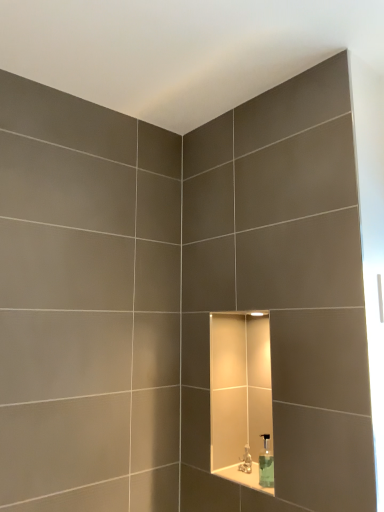
This screenshot has height=512, width=384. What do you see at coordinates (244, 476) in the screenshot?
I see `white glossy ledge at center` at bounding box center [244, 476].

Where is `translucent plastic faucet at center`? This screenshot has width=384, height=512. translucent plastic faucet at center is located at coordinates (246, 461).

Where is `white glossy ledge at center`? The image size is (384, 512). white glossy ledge at center is located at coordinates (244, 476).

Is point (228, 469) positioned behind point (259, 456)?

No, it is in front of (259, 456).

From the picture: From a real-world perspective, between white glossy ledge at center and clear glass soap dispenser at center, who is vertically lower?

In real-world perspective, white glossy ledge at center is lower.

Can you confirm if white glossy ledge at center is wider than clear glass soap dispenser at center?

Yes, white glossy ledge at center is wider than clear glass soap dispenser at center.

Can you tell me how much white glossy ledge at center and clear glass soap dispenser at center differ in facing direction?

They differ by 0.157 degrees in their facing directions.

Which object is closer to the camera, clear glass soap dispenser at center or white glossy ledge at center?

white glossy ledge at center is closer to the camera.

Is clear glass soap dispenser at center bigger than white glossy ledge at center?

Yes, clear glass soap dispenser at center is bigger than white glossy ledge at center.

Find the location of a particular element. ledge lying in front of the clear glass soap dispenser at center is located at coordinates (244, 476).

From a real-world perspective, does clear glass soap dispenser at center stand above white glossy ledge at center?

Yes.

Does point (220, 468) appear closer or farther from the camera than point (246, 462)?

Point (220, 468) is farther from the camera than point (246, 462).

Can you tell me how much white glossy ledge at center and translucent plastic faucet at center differ in facing direction?

The facing directions of white glossy ledge at center and translucent plastic faucet at center are 1.02 degrees apart.

From a real-world perspective, is white glossy ledge at center located beneath translucent plastic faucet at center?

Yes.

How much distance is there between white glossy ledge at center and translucent plastic faucet at center?

A distance of 2.08 inches exists between white glossy ledge at center and translucent plastic faucet at center.

From the picture: From a real-world perspective, which is physically above, translucent plastic faucet at center or clear glass soap dispenser at center?

clear glass soap dispenser at center, from a real-world perspective.

Considering the sizes of objects translucent plastic faucet at center and clear glass soap dispenser at center in the image provided, who is shorter, translucent plastic faucet at center or clear glass soap dispenser at center?

translucent plastic faucet at center.

Would you say translucent plastic faucet at center contains clear glass soap dispenser at center?

No, clear glass soap dispenser at center is not inside translucent plastic faucet at center.

Is translucent plastic faucet at center positioned with its back to clear glass soap dispenser at center?

No.

Which of these two, clear glass soap dispenser at center or translucent plastic faucet at center, is thinner?

With smaller width is translucent plastic faucet at center.

Relative to translucent plastic faucet at center, is clear glass soap dispenser at center in front or behind?

In the image, clear glass soap dispenser at center appears in front of translucent plastic faucet at center.

Identify the location of soap dispenser positioned vertically above the translucent plastic faucet at center (from a real-world perspective). The height and width of the screenshot is (512, 384). (266, 464).

Is clear glass soap dispenser at center positioned with its back to translucent plastic faucet at center?

clear glass soap dispenser at center does not have its back to translucent plastic faucet at center.

From a real-world perspective, is translucent plastic faucet at center positioned above or below white glossy ledge at center?

From a real-world perspective, translucent plastic faucet at center is physically above white glossy ledge at center.

Considering the relative sizes of translucent plastic faucet at center and white glossy ledge at center in the image provided, is translucent plastic faucet at center smaller than white glossy ledge at center?

Yes, translucent plastic faucet at center is smaller than white glossy ledge at center.

From their relative heights in the image, would you say translucent plastic faucet at center is taller or shorter than white glossy ledge at center?

translucent plastic faucet at center is taller than white glossy ledge at center.

Visually, is translucent plastic faucet at center positioned to the left or to the right of white glossy ledge at center?

translucent plastic faucet at center is to the left of white glossy ledge at center.

Identify the location of soap dispenser positioned vertically above the white glossy ledge at center (from a real-world perspective). The height and width of the screenshot is (512, 384). (266, 464).

At what (x,y) coordinates should I click in order to perform the action: click on soap dispenser on the right side of white glossy ledge at center. Please return your answer as a coordinate pair (x, y). Looking at the image, I should click on (266, 464).

Which object lies nearer to the anchor point translucent plastic faucet at center, white glossy ledge at center or clear glass soap dispenser at center?

white glossy ledge at center.

Estimate the real-world distances between objects in this image. Which object is further from translucent plastic faucet at center, clear glass soap dispenser at center or white glossy ledge at center?

clear glass soap dispenser at center.

Looking at the image, which one is located closer to white glossy ledge at center, translucent plastic faucet at center or clear glass soap dispenser at center?

translucent plastic faucet at center lies closer to white glossy ledge at center than the other object.

Considering their positions, is white glossy ledge at center positioned further to clear glass soap dispenser at center than translucent plastic faucet at center?

The object further to clear glass soap dispenser at center is translucent plastic faucet at center.

From the image, which object appears to be nearer to clear glass soap dispenser at center, translucent plastic faucet at center or white glossy ledge at center?

The object closer to clear glass soap dispenser at center is white glossy ledge at center.

Based on their spatial positions, is clear glass soap dispenser at center or translucent plastic faucet at center further from white glossy ledge at center?

Among the two, clear glass soap dispenser at center is located further to white glossy ledge at center.

Where is `soap dispenser located between white glossy ledge at center and translucent plastic faucet at center in the depth direction`? The image size is (384, 512). soap dispenser located between white glossy ledge at center and translucent plastic faucet at center in the depth direction is located at coordinates (266, 464).